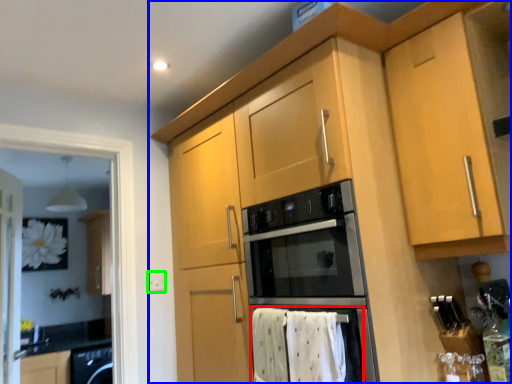
Question: Which is farther away from bath towel (highlighted by a red box)? cabinetry (highlighted by a blue box) or electric outlet (highlighted by a green box)?

Choices:
 (A) cabinetry
 (B) electric outlet

Answer: (B)